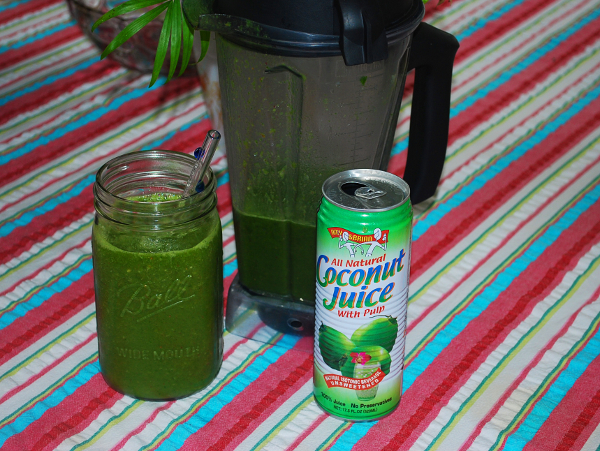
In order to click on mason jar in this screenshot , I will do `click(157, 206)`.